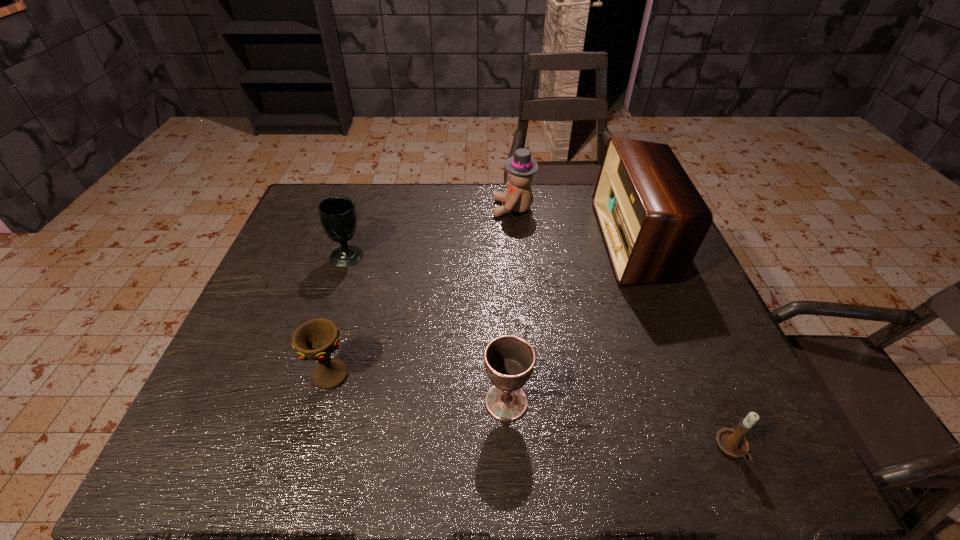
Identify the location of object that is at the far right corner. The width and height of the screenshot is (960, 540). (653, 220).

The height and width of the screenshot is (540, 960). Identify the location of object located in the near right corner section of the desktop. (732, 442).

Locate an element on the screen. This screenshot has width=960, height=540. vacant space at the far edge is located at coordinates (565, 219).

In the image, there is a desktop. Where is `vacant space at the near edge`? The image size is (960, 540). vacant space at the near edge is located at coordinates (549, 469).

Locate an element on the screen. free point at the left edge is located at coordinates (281, 255).

You are a GUI agent. You are given a task and a screenshot of the screen. Output one action in this format:
    pyautogui.click(x=<x>, y=<y>)
    Task: Click on the free space at the right edge of the desktop
    This screenshot has height=540, width=960.
    Given the screenshot: What is the action you would take?
    pyautogui.click(x=650, y=314)

Find the location of a particular element. This screenshot has width=960, height=540. empty space between the rag_doll and the rightmost chalice is located at coordinates 510,305.

This screenshot has width=960, height=540. I want to click on empty space between the shortest object and the radio receiver, so click(x=684, y=345).

Locate an element on the screen. This screenshot has height=540, width=960. free space between the farthest chalice and the candle holder is located at coordinates (540, 352).

This screenshot has height=540, width=960. I want to click on free space between the rightmost chalice and the farthest chalice, so click(x=427, y=329).